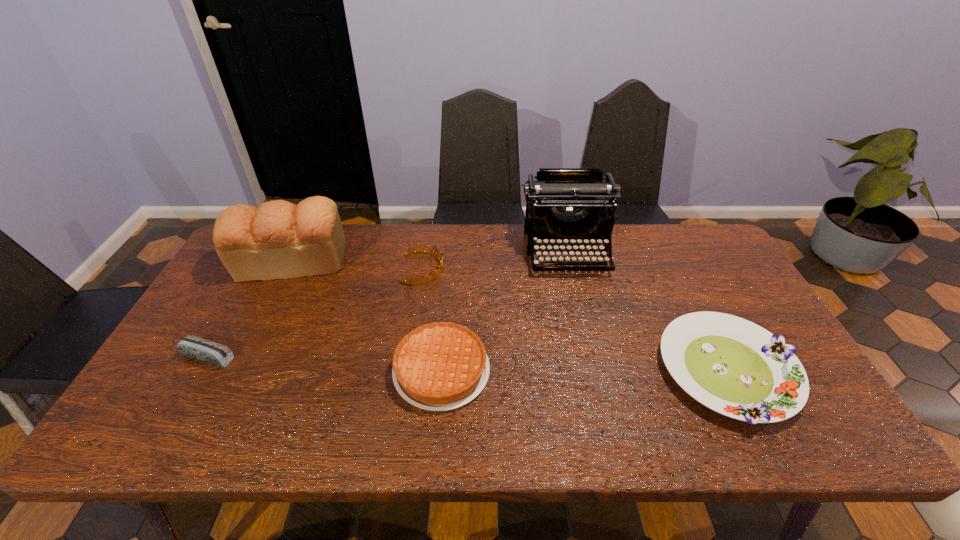
Image resolution: width=960 pixels, height=540 pixels. What are the coordinates of `free space in the image that satisfies the following two spatial constraints: 1. on the typing side of the fifth object from left to right; 2. on the right side of the salad plate` in the screenshot? It's located at (594, 371).

Image resolution: width=960 pixels, height=540 pixels. In order to click on free space in the image that satisfies the following two spatial constraints: 1. on the front-facing side of the pie; 2. on the left side of the fourth shortest object in this screenshot , I will do `click(409, 370)`.

The width and height of the screenshot is (960, 540). Identify the location of free region that satisfies the following two spatial constraints: 1. on the typing side of the fifth object from left to right; 2. on the left side of the rightmost object. (594, 371).

The width and height of the screenshot is (960, 540). I want to click on vacant point that satisfies the following two spatial constraints: 1. on the front-facing side of the tiara; 2. on the back side of the pie, so click(409, 370).

At what (x,y) coordinates should I click in order to perform the action: click on free spot that satisfies the following two spatial constraints: 1. on the typing side of the rightmost object; 2. on the right side of the second object from right to left. Please return your answer as a coordinate pair (x, y). The image size is (960, 540). Looking at the image, I should click on (594, 371).

Find the location of a particular element. This screenshot has width=960, height=540. free location that satisfies the following two spatial constraints: 1. on the typing side of the second object from right to left; 2. on the front-facing side of the tiara is located at coordinates (570, 268).

At what (x,y) coordinates should I click in order to perform the action: click on vacant space that satisfies the following two spatial constraints: 1. on the typing side of the salad plate; 2. on the right side of the typewriter. Please return your answer as a coordinate pair (x, y). Image resolution: width=960 pixels, height=540 pixels. Looking at the image, I should click on (594, 371).